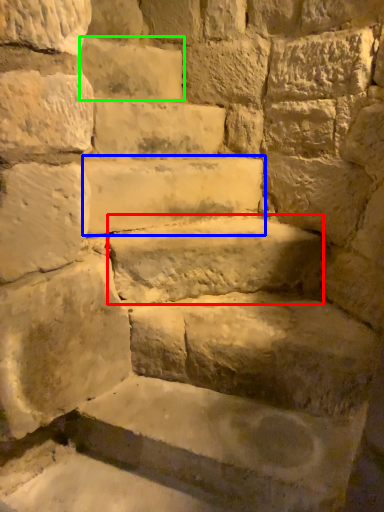
Question: Which object is positioned farthest from brick (highlighted by a red box)? Select from stone (highlighted by a blue box) and brick (highlighted by a green box).

Choices:
 (A) stone
 (B) brick

Answer: (B)